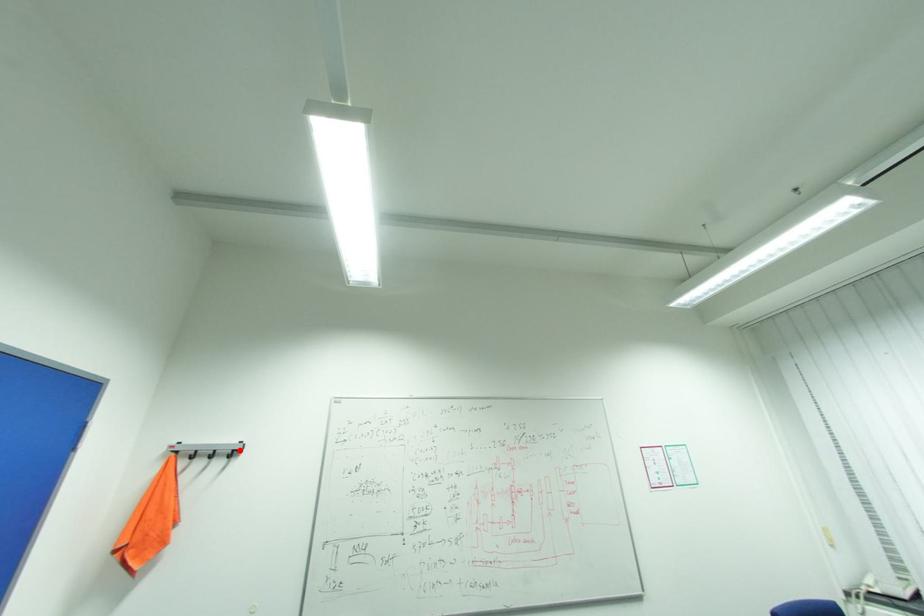
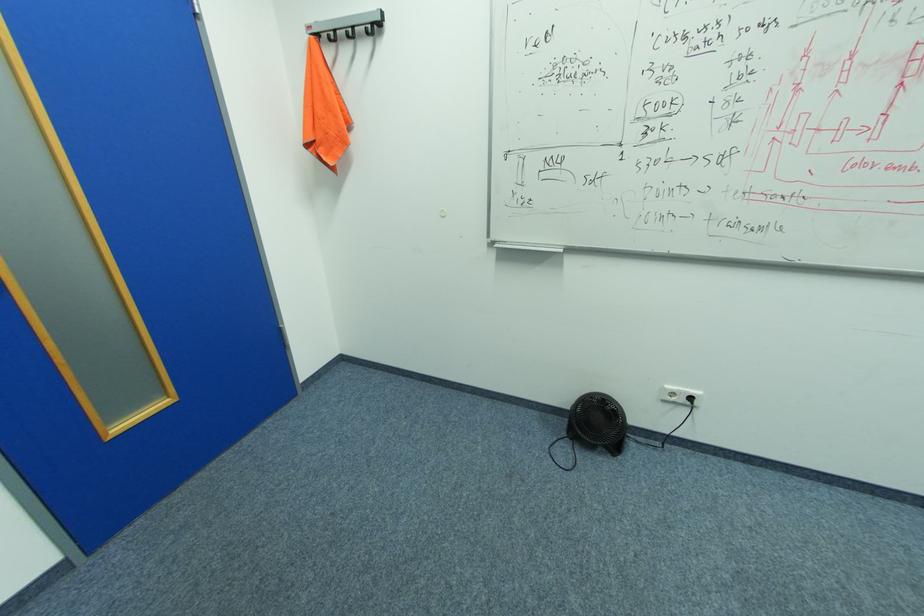
Where in the second image is the point corresponding to the highlighted location from the first image?

(379, 23)